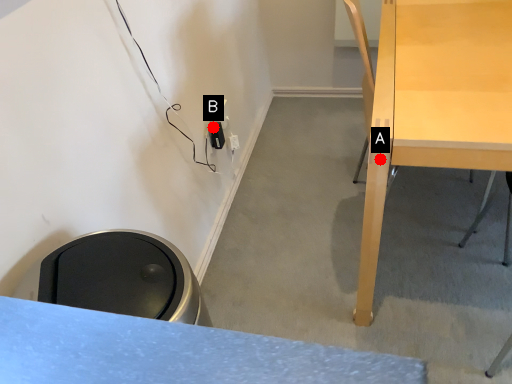
Question: Two points are circled on the image, labeled by A and B beside each circle. Which point is farther to the camera?

Choices:
 (A) A is further
 (B) B is further

Answer: (B)